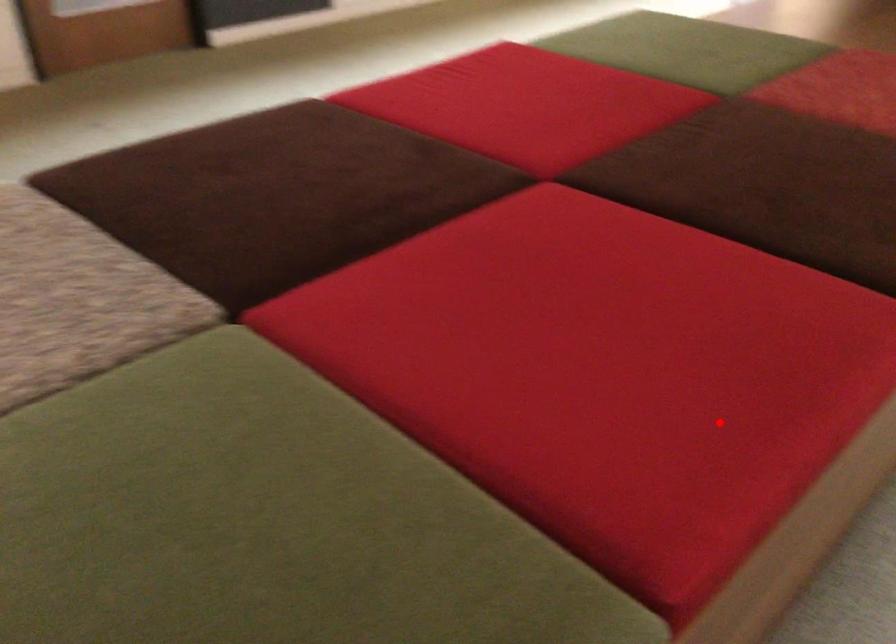
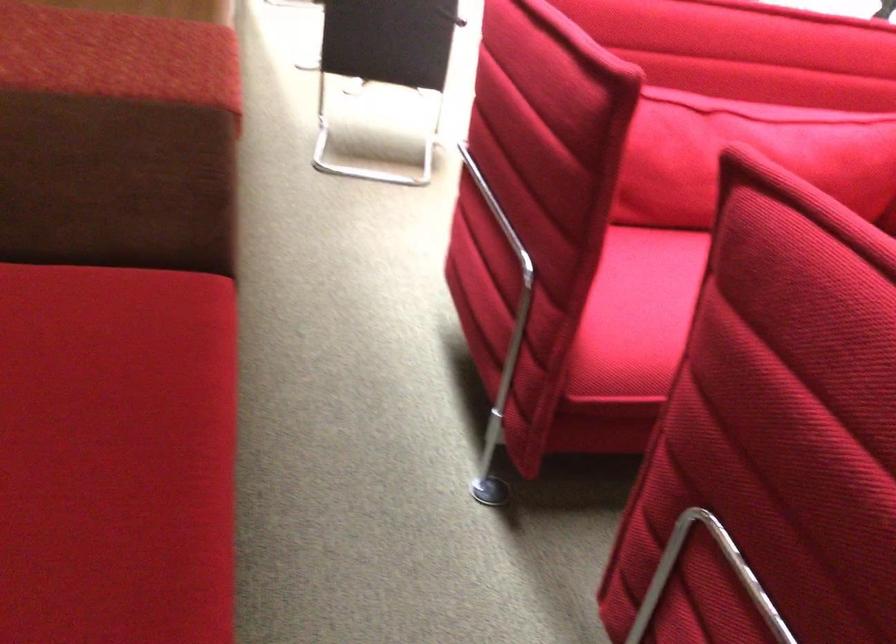
Locate, in the second image, the point that corresponds to the highlighted location in the first image.

(116, 455)